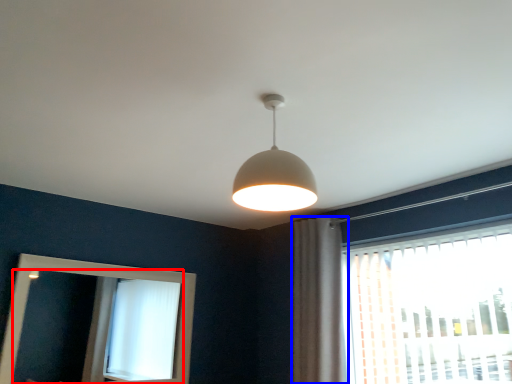
Question: Which point is closer to the camera, mirror (highlighted by a red box) or curtain (highlighted by a blue box)?

Choices:
 (A) mirror
 (B) curtain

Answer: (A)